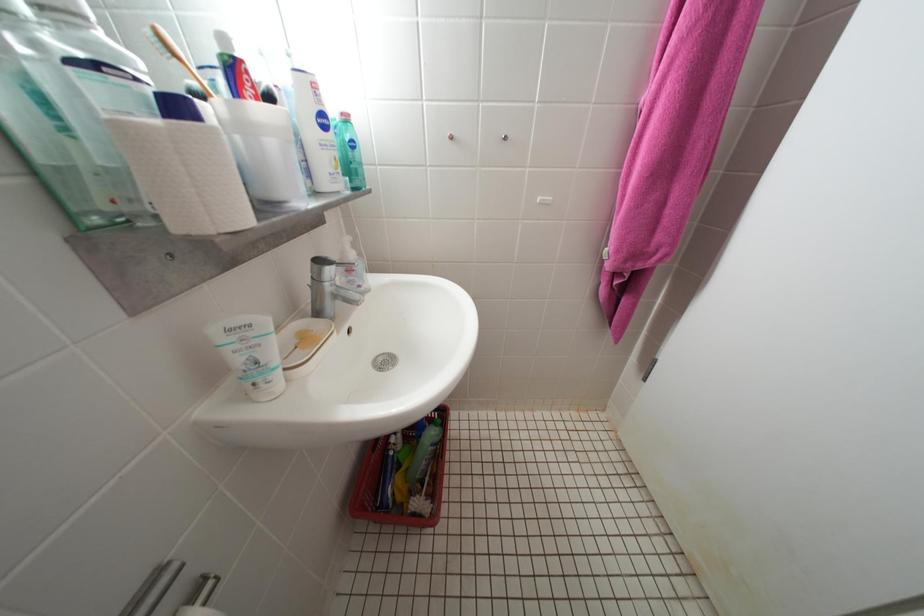
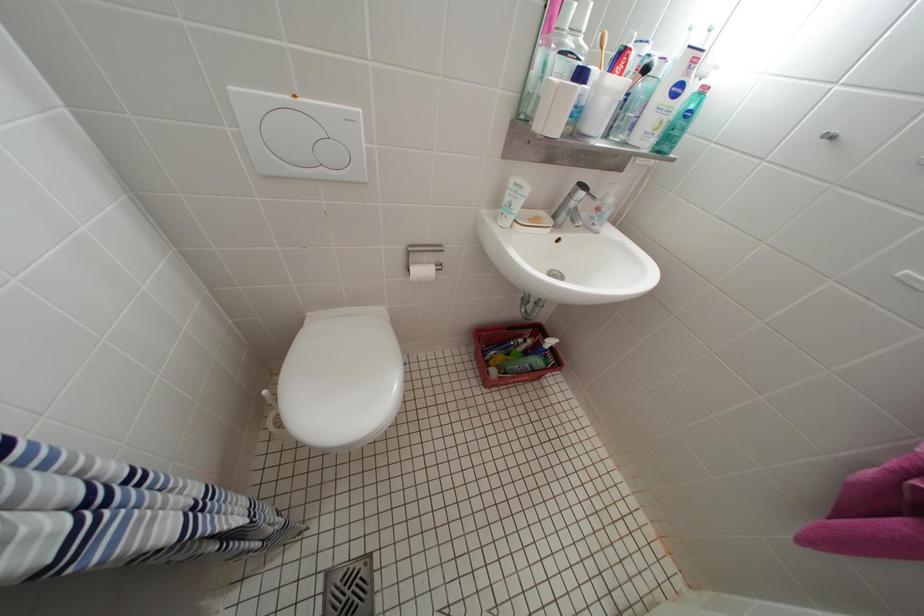
Based on the continuous images, in which direction is the camera rotating?

The rotation direction of the camera is left-down.